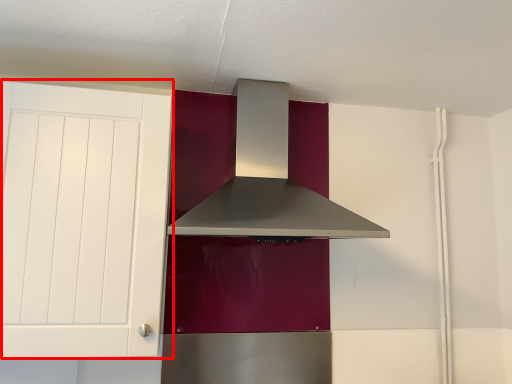
Question: From the image's perspective, where is cabinetry (annotated by the red box) located relative to home appliance?

Choices:
 (A) above
 (B) below

Answer: (B)